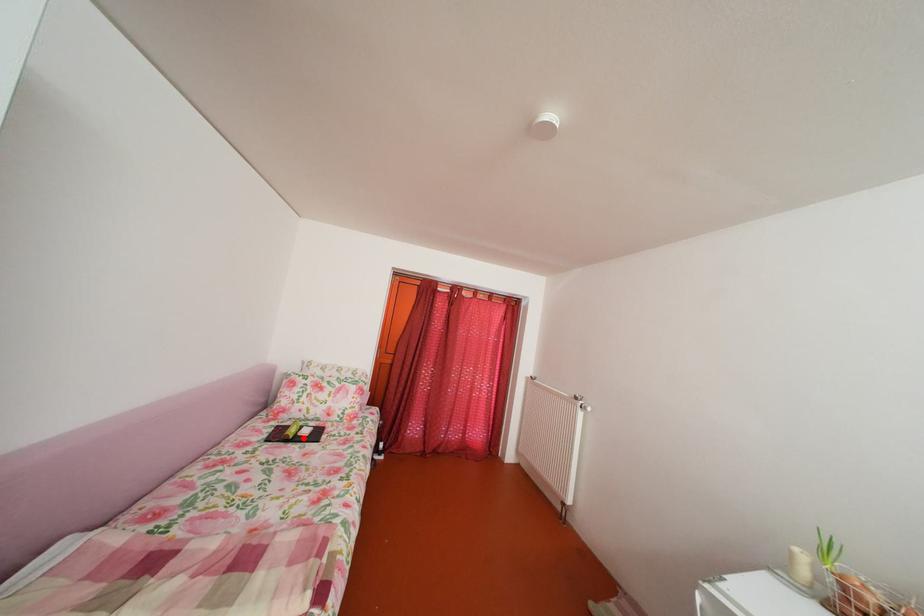
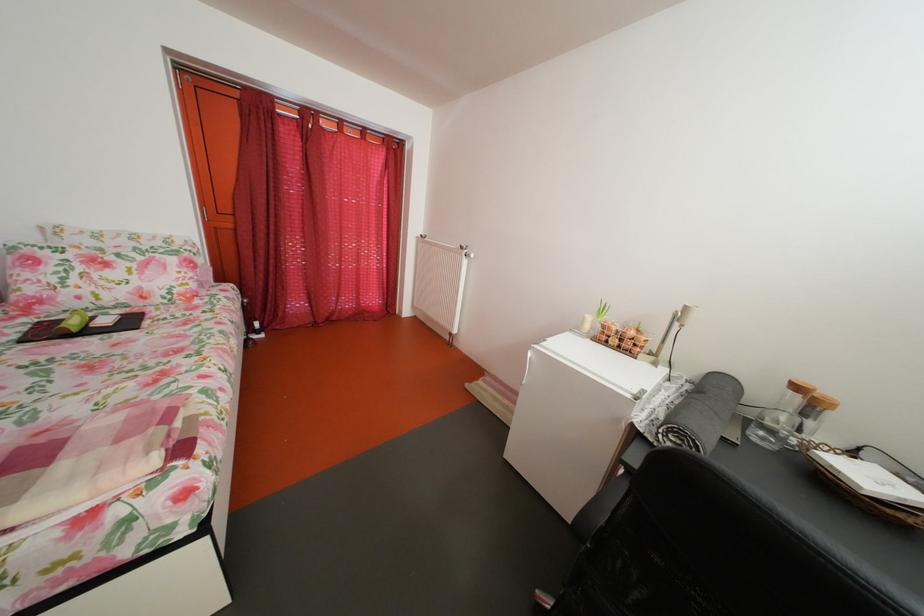
The point at the highlighted location is marked in the first image. Where is the corresponding point in the second image?

(83, 330)